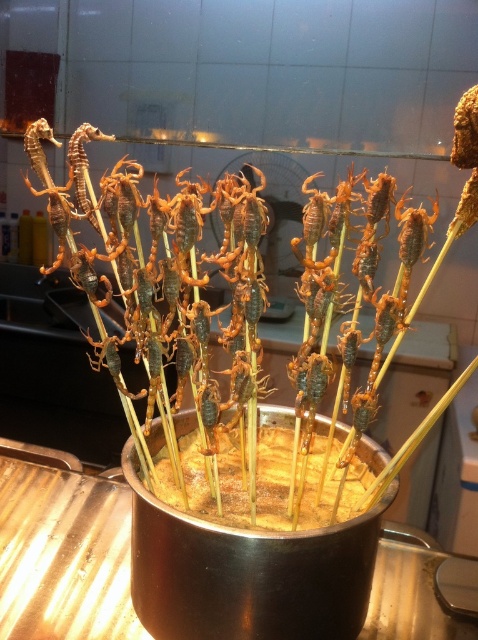
You are a food critic evaluating the presentation of this dish. The dish has two types of scorpions prepared in different textures. Which scorpion, the brown crunchy scorpion at center or the brown crispy scorpions at center, is larger in size?

The brown crunchy scorpion at center is bigger than the brown crispy scorpions at center.